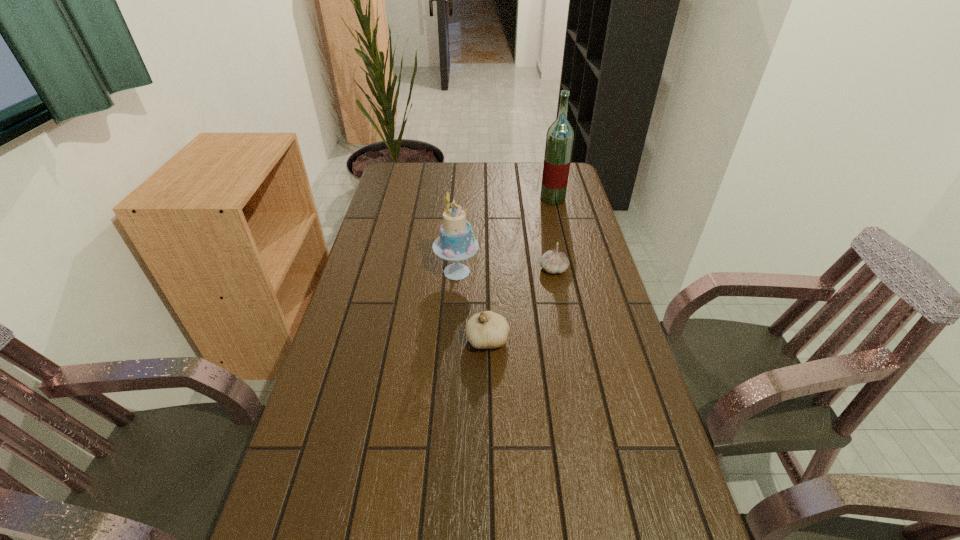
Image resolution: width=960 pixels, height=540 pixels. What are the coordinates of `liquor situated at the right edge` in the screenshot? It's located at point(559,140).

You are a GUI agent. You are given a task and a screenshot of the screen. Output one action in this format:
    pyautogui.click(x=<x>, y=<y>)
    Task: Click on the garlic that is at the right edge
    The width and height of the screenshot is (960, 540).
    Given the screenshot: What is the action you would take?
    pyautogui.click(x=553, y=261)

Find the location of `vacant space at the left edge of the desktop`. vacant space at the left edge of the desktop is located at coordinates (331, 482).

Identify the location of vacant region at the right edge. This screenshot has width=960, height=540. (565, 277).

Locate an element on the screen. The image size is (960, 540). free spot at the far left corner of the desktop is located at coordinates (424, 165).

Where is `free space between the nearer garlic and the right garlic`? This screenshot has width=960, height=540. free space between the nearer garlic and the right garlic is located at coordinates (520, 305).

At what (x,y) coordinates should I click in order to perform the action: click on free space between the second tallest object and the farthest object. Please return your answer as a coordinate pair (x, y). This screenshot has width=960, height=540. Looking at the image, I should click on (505, 235).

Where is `free space between the right garlic and the liquor`? Image resolution: width=960 pixels, height=540 pixels. free space between the right garlic and the liquor is located at coordinates (553, 234).

You are a GUI agent. You are given a task and a screenshot of the screen. Output one action in this format:
    pyautogui.click(x=<x>, y=<y>)
    Task: Click on the free space between the farthest object and the right garlic
    This screenshot has height=540, width=960.
    Given the screenshot: What is the action you would take?
    pyautogui.click(x=553, y=234)

Locate an element on the screen. The image size is (960, 540). unoccupied area between the tallest object and the left garlic is located at coordinates (520, 269).